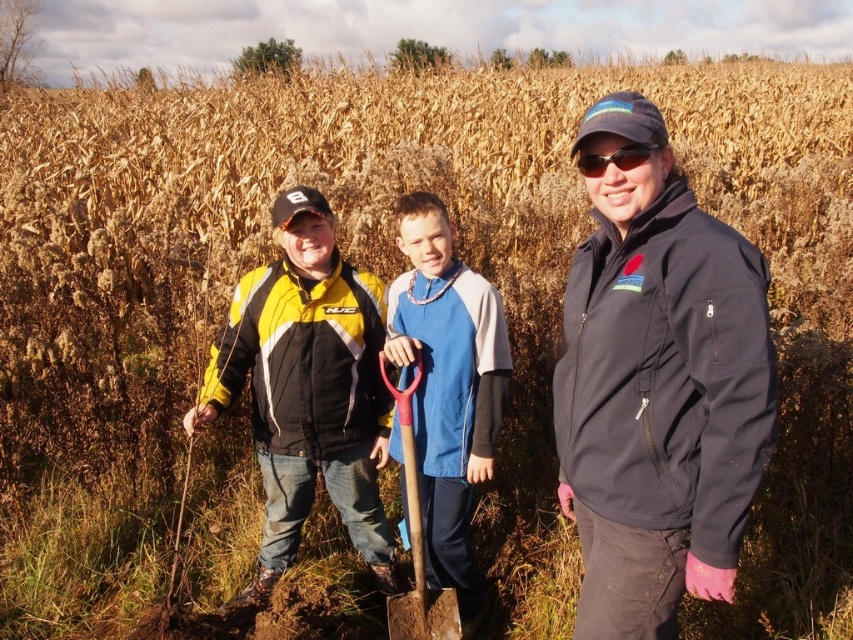
Is red plastic shovel at center bigger than black plastic sunglasses at center?

Yes.

Consider the image. Which is above, red plastic shovel at center or black plastic sunglasses at center?

black plastic sunglasses at center

Is point (416, 577) positioned behind point (636, 144)?

Yes, point (416, 577) is farther from viewer.

Image resolution: width=853 pixels, height=640 pixels. I want to click on red plastic shovel at center, so point(416,541).

Is dark blue softshell jacket at center bigger than black plastic sunglasses at center?

Yes, dark blue softshell jacket at center is bigger than black plastic sunglasses at center.

I want to click on dark blue softshell jacket at center, so click(x=657, y=387).

Is dark blue softshell jacket at center shorter than red plastic shovel at center?

In fact, dark blue softshell jacket at center may be taller than red plastic shovel at center.

Does dark blue softshell jacket at center have a lesser width compared to red plastic shovel at center?

No, dark blue softshell jacket at center is not thinner than red plastic shovel at center.

At what (x,y) coordinates should I click in order to perform the action: click on dark blue softshell jacket at center. Please return your answer as a coordinate pair (x, y). The image size is (853, 640). Looking at the image, I should click on (657, 387).